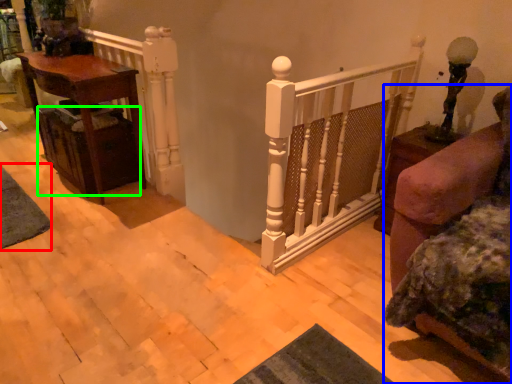
Question: Which object is positioned farthest from mat (highlighted by a red box)? Select from furniture (highlighted by a blue box) and drawer (highlighted by a green box).

Choices:
 (A) furniture
 (B) drawer

Answer: (A)